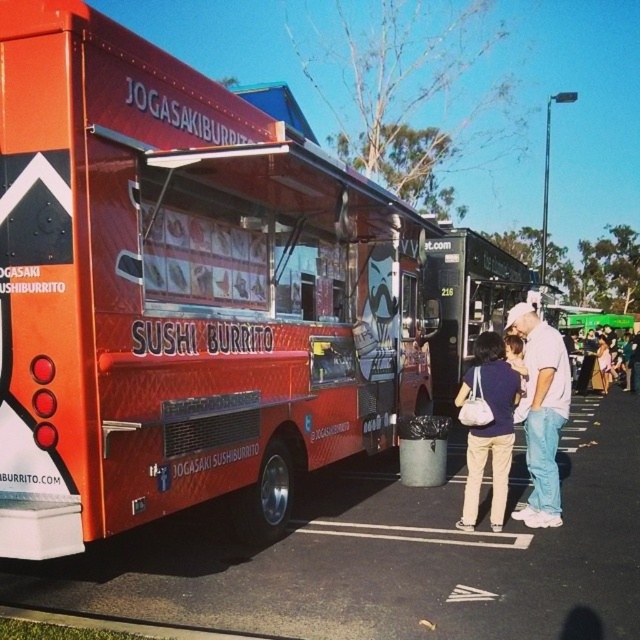
Question: Can you confirm if orange matte food truck at center is positioned to the left of white painted line at lower center?

Choices:
 (A) no
 (B) yes

Answer: (B)

Question: Estimate the real-world distances between objects in this image. Which object is closer to the denim jacket at lower right?

Choices:
 (A) orange matte food truck at center
 (B) matte blue shirt at center
 (C) white painted line at lower center

Answer: (A)

Question: Can you confirm if smooth asphalt parking lot at center is thinner than matte blue shirt at center?

Choices:
 (A) yes
 (B) no

Answer: (B)

Question: Which object appears closest to the camera in this image?

Choices:
 (A) smooth asphalt parking lot at center
 (B) denim jacket at lower right

Answer: (A)

Question: Does smooth asphalt parking lot at center have a smaller size compared to white cotton shirt at right?

Choices:
 (A) yes
 (B) no

Answer: (B)

Question: Which is farther from the smooth asphalt parking lot at center?

Choices:
 (A) orange matte food truck at center
 (B) denim jacket at lower right
 (C) white cotton shirt at right
 (D) white painted line at lower center

Answer: (B)